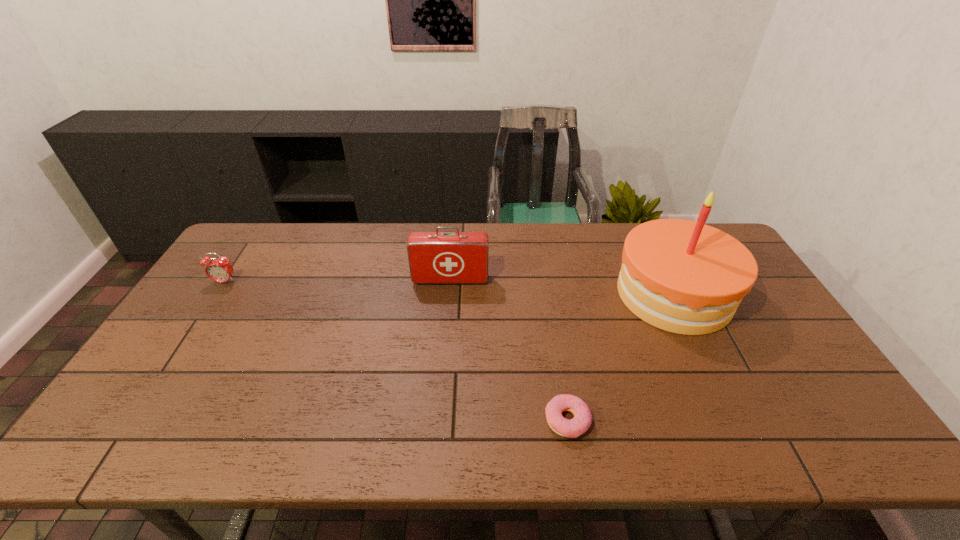
Where is `free space between the doughnut and the tallest object`? The image size is (960, 540). free space between the doughnut and the tallest object is located at coordinates (620, 357).

The image size is (960, 540). What are the coordinates of `the closest object to the birthday cake` in the screenshot? It's located at (582, 420).

Locate which object is the closest to the leftmost object. Please provide its 2D coordinates. Your answer should be formatted as a tuple, i.e. [(x, y)], where the tuple contains the x and y coordinates of a point satisfying the conditions above.

[(436, 257)]

Locate an element on the screen. vacant point that satisfies the following two spatial constraints: 1. on the face of the leftmost object; 2. on the left side of the birthday cake is located at coordinates (217, 294).

This screenshot has height=540, width=960. I want to click on vacant region that satisfies the following two spatial constraints: 1. on the face of the rightmost object; 2. on the left side of the alarm clock, so click(217, 294).

I want to click on blank area in the image that satisfies the following two spatial constraints: 1. on the side of the birthday cake with the first aid cross symbol; 2. on the left side of the first-aid kit, so click(449, 294).

At what (x,y) coordinates should I click in order to perform the action: click on blank area in the image that satisfies the following two spatial constraints: 1. on the side of the tallest object with the first aid cross symbol; 2. on the right side of the first-aid kit. Please return your answer as a coordinate pair (x, y). Looking at the image, I should click on (449, 294).

The width and height of the screenshot is (960, 540). What are the coordinates of `free region that satisfies the following two spatial constraints: 1. on the face of the leftmost object; 2. on the right side of the birthday cake` in the screenshot? It's located at (217, 294).

At what (x,y) coordinates should I click in order to perform the action: click on free spot that satisfies the following two spatial constraints: 1. on the side of the birthday cake with the first aid cross symbol; 2. on the left side of the third object from right to left. Please return your answer as a coordinate pair (x, y). Image resolution: width=960 pixels, height=540 pixels. Looking at the image, I should click on (449, 294).

The height and width of the screenshot is (540, 960). Identify the location of vacant space that satisfies the following two spatial constraints: 1. on the face of the alarm clock; 2. on the right side of the second object from right to left. (134, 420).